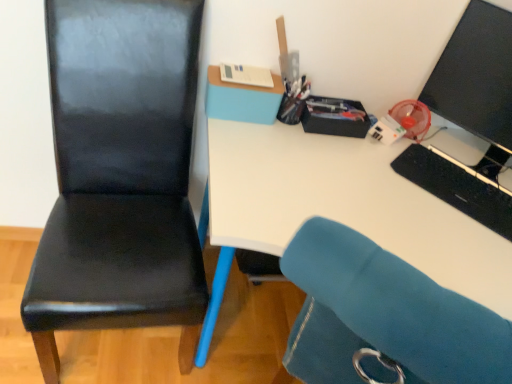
Identify the location of vacant space that is in between black matte keyboard at right and matte black stationery box at upper right, the third stationery from the left. The image size is (512, 384). (381, 167).